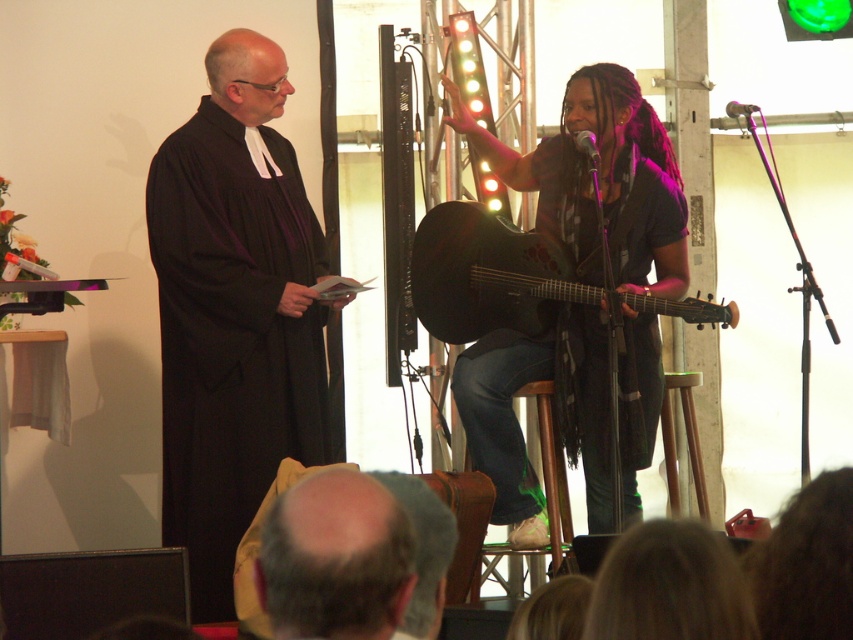
You are an event organizer setting up a stage for a performance. You have two guitars on stage, a matte black guitar at center and a matte black acoustic guitar at center. Which guitar is taller?

The matte black guitar at center is taller than the matte black acoustic guitar at center.

You are a photographer standing at the camera position. You want to capture a photo of the black matte robe at left without any obstructions. Is the robe within your camera frame?

The black matte robe at left is 12.32 feet away from the camera. Since the robe is within the camera frame, you can capture it without obstructions.